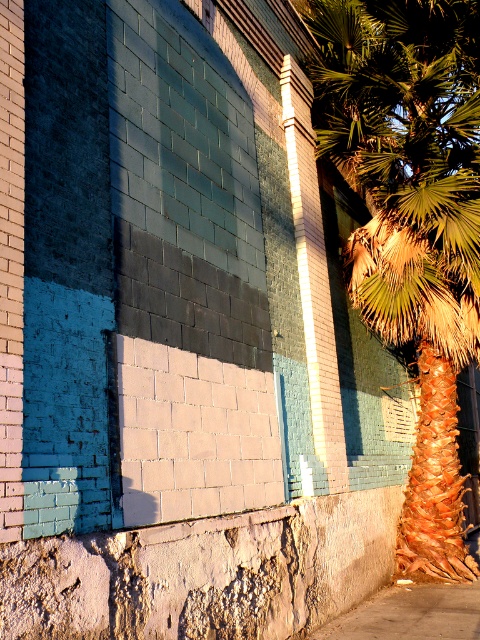
Does point (476, 86) come farther from viewer compared to point (386, 628)?

Yes, it is.

The height and width of the screenshot is (640, 480). I want to click on green leafy palm at right, so click(x=411, y=221).

Where is `green leafy palm at right`? The width and height of the screenshot is (480, 640). green leafy palm at right is located at coordinates (411, 221).